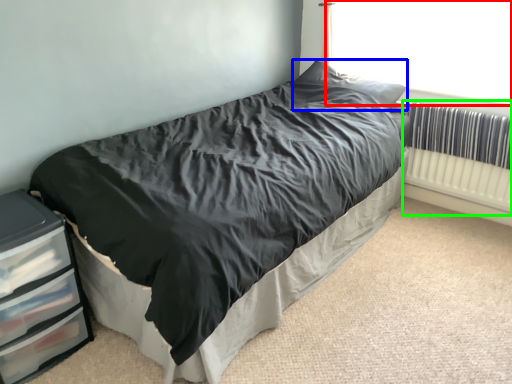
Question: Which object is positioned farthest from window screen (highlighted by a red box)? Select from pillow (highlighted by a blue box) and radiator (highlighted by a green box).

Choices:
 (A) pillow
 (B) radiator

Answer: (B)